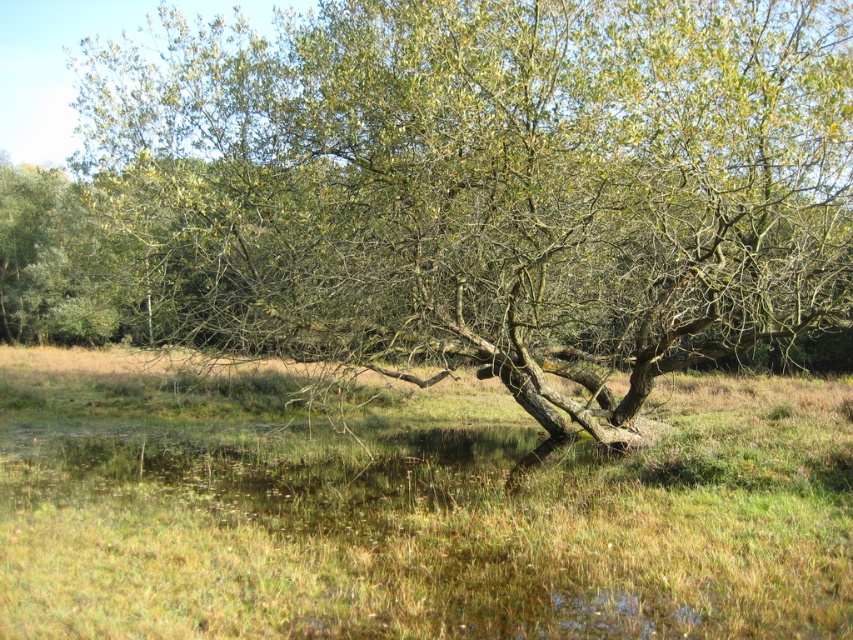
Which is more to the left, green leafy tree at center or green grass at center?

From the viewer's perspective, green leafy tree at center appears more on the left side.

Who is more forward, (735,81) or (312,376)?

Point (735,81) is in front.

The height and width of the screenshot is (640, 853). What are the coordinates of `green leafy tree at center` in the screenshot? It's located at (492, 186).